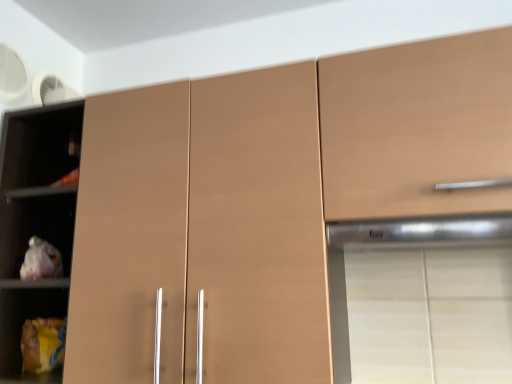
The image size is (512, 384). What do you see at coordinates (417, 127) in the screenshot? I see `matte brown cabinet at upper right` at bounding box center [417, 127].

This screenshot has width=512, height=384. I want to click on matte brown cabinet at upper right, so click(417, 127).

Measure the distance from matte brown cabinet at upper right to satin silver exhaust hood at upper right.

6.64 inches.

From a real-world perspective, is matte brown cabinet at upper right positioned above or below satin silver exhaust hood at upper right?

Clearly, from a real-world perspective, matte brown cabinet at upper right is above satin silver exhaust hood at upper right.

From the image's perspective, is matte brown cabinet at upper right on top of satin silver exhaust hood at upper right?

Yes, from the image's perspective, matte brown cabinet at upper right is on top of satin silver exhaust hood at upper right.

Does matte brown cabinet at upper right have a larger size compared to satin silver exhaust hood at upper right?

Correct, matte brown cabinet at upper right is larger in size than satin silver exhaust hood at upper right.

Is matte brown cupboard at left not close to satin silver exhaust hood at upper right?

They are positioned close to each other.

Which of these two, matte brown cupboard at left or satin silver exhaust hood at upper right, is smaller?

satin silver exhaust hood at upper right is smaller.

Does matte brown cupboard at left turn towards satin silver exhaust hood at upper right?

No, matte brown cupboard at left is not facing towards satin silver exhaust hood at upper right.

Is the depth of matte brown cabinet at upper right greater than that of matte brown cupboard at left?

No.

Can you confirm if matte brown cabinet at upper right is positioned to the left of matte brown cupboard at left?

Incorrect, matte brown cabinet at upper right is not on the left side of matte brown cupboard at left.

Does matte brown cabinet at upper right have a lesser width compared to matte brown cupboard at left?

No, matte brown cabinet at upper right is not thinner than matte brown cupboard at left.

Looking at this image, is satin silver exhaust hood at upper right bigger or smaller than matte brown cupboard at left?

satin silver exhaust hood at upper right is smaller than matte brown cupboard at left.

Does point (493, 230) come closer to viewer compared to point (18, 333)?

Yes, point (493, 230) is closer to viewer.

Based on the photo, choose the correct answer: Is satin silver exhaust hood at upper right inside matte brown cupboard at left or outside it?

satin silver exhaust hood at upper right is not enclosed by matte brown cupboard at left.

Can you tell me how much satin silver exhaust hood at upper right and matte brown cupboard at left differ in facing direction?

The facing directions of satin silver exhaust hood at upper right and matte brown cupboard at left are 3.41e-05 degrees apart.

Is matte brown cupboard at left to the left of matte brown cabinet at upper right from the viewer's perspective?

Yes, matte brown cupboard at left is to the left of matte brown cabinet at upper right.

Is matte brown cupboard at left aimed at matte brown cabinet at upper right?

No.

Considering the relative sizes of matte brown cupboard at left and matte brown cabinet at upper right in the image provided, is matte brown cupboard at left shorter than matte brown cabinet at upper right?

No.

Considering the sizes of matte brown cupboard at left and matte brown cabinet at upper right in the image, is matte brown cupboard at left wider or thinner than matte brown cabinet at upper right?

Considering their sizes, matte brown cupboard at left looks slimmer than matte brown cabinet at upper right.

From a real-world perspective, between satin silver exhaust hood at upper right and matte brown cabinet at upper right, who is vertically higher?

From a 3D spatial view, matte brown cabinet at upper right is above.

In the scene shown: Which is more to the right, satin silver exhaust hood at upper right or matte brown cabinet at upper right?

matte brown cabinet at upper right.

From their relative heights in the image, would you say satin silver exhaust hood at upper right is taller or shorter than matte brown cabinet at upper right?

satin silver exhaust hood at upper right is shorter than matte brown cabinet at upper right.

Looking at this image, would you consider satin silver exhaust hood at upper right to be distant from matte brown cabinet at upper right?

No, there isn't a large distance between satin silver exhaust hood at upper right and matte brown cabinet at upper right.

You are a GUI agent. You are given a task and a screenshot of the screen. Output one action in this format:
    pyautogui.click(x=<x>, y=<y>)
    Task: Click on the exhaust hood below the matte brown cabinet at upper right (from a real-world perspective)
    The width and height of the screenshot is (512, 384).
    Given the screenshot: What is the action you would take?
    pyautogui.click(x=422, y=231)

I want to click on exhaust hood in front of the matte brown cupboard at left, so click(422, 231).

Estimate the real-world distances between objects in this image. Which object is further from satin silver exhaust hood at upper right, matte brown cupboard at left or matte brown cabinet at upper right?

matte brown cupboard at left lies further to satin silver exhaust hood at upper right than the other object.

Which object lies nearer to the anchor point matte brown cabinet at upper right, satin silver exhaust hood at upper right or matte brown cupboard at left?

The object closer to matte brown cabinet at upper right is satin silver exhaust hood at upper right.

From the image, which object appears to be farther from matte brown cupboard at left, satin silver exhaust hood at upper right or matte brown cabinet at upper right?

Among the two, satin silver exhaust hood at upper right is located further to matte brown cupboard at left.

Estimate the real-world distances between objects in this image. Which object is closer to satin silver exhaust hood at upper right, matte brown cabinet at upper right or matte brown cupboard at left?

The object closer to satin silver exhaust hood at upper right is matte brown cabinet at upper right.

Based on the photo, estimate the real-world distances between objects in this image. Which object is further from matte brown cabinet at upper right, matte brown cupboard at left or satin silver exhaust hood at upper right?

Based on the image, matte brown cupboard at left appears to be further to matte brown cabinet at upper right.

Which object lies nearer to the anchor point matte brown cupboard at left, matte brown cabinet at upper right or satin silver exhaust hood at upper right?

matte brown cabinet at upper right is positioned closer to the anchor matte brown cupboard at left.

Where is `exhaust hood between matte brown cupboard at left and matte brown cabinet at upper right from left to right`? The height and width of the screenshot is (384, 512). exhaust hood between matte brown cupboard at left and matte brown cabinet at upper right from left to right is located at coordinates 422,231.